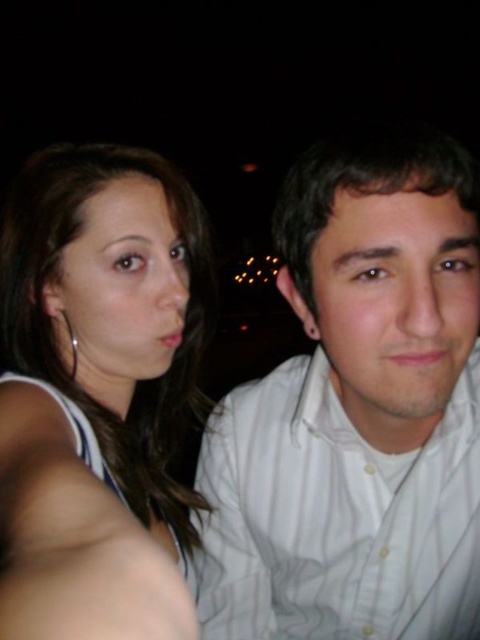
Question: Does white striped shirt at center have a larger size compared to white smooth skin at center?

Choices:
 (A) yes
 (B) no

Answer: (A)

Question: Can you confirm if white striped shirt at center is wider than white smooth skin at center?

Choices:
 (A) yes
 (B) no

Answer: (A)

Question: Can you confirm if matte white tank top at left is wider than white smooth skin at center?

Choices:
 (A) no
 (B) yes

Answer: (B)

Question: Which object is positioned closest to the white smooth skin at center?

Choices:
 (A) matte white tank top at left
 (B) white striped shirt at center

Answer: (A)

Question: Which point appears closest to the camera in this image?

Choices:
 (A) (66, 404)
 (B) (312, 522)
 (C) (171, 572)

Answer: (C)

Question: Which object is the closest to the white striped shirt at center?

Choices:
 (A) white smooth skin at center
 (B) matte white tank top at left

Answer: (B)